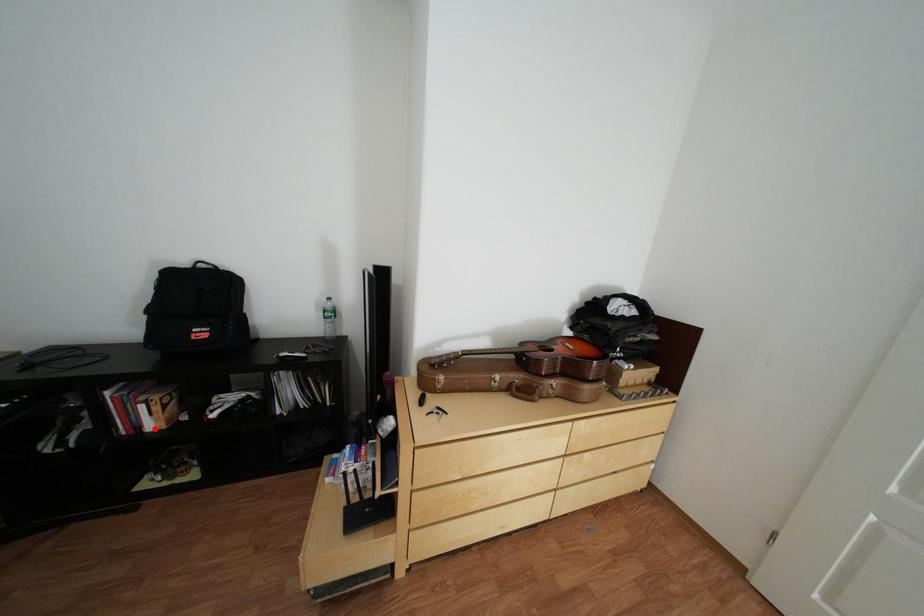
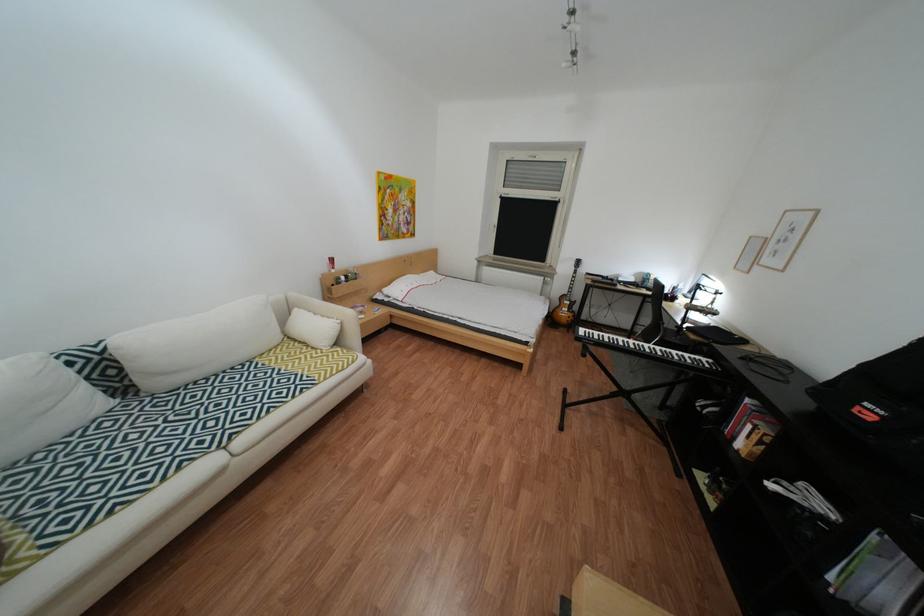
Where in the second image is the point corresponding to the highlighted location from the first image?

(749, 439)